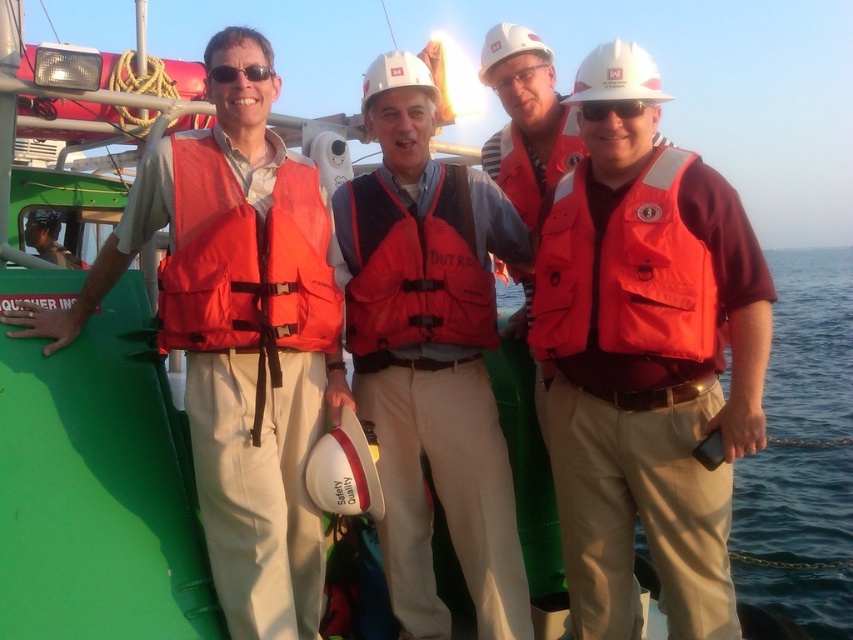
You are a safety inspector on the boat and need to check if the equipment is properly positioned. Are the matte white goggles at center placed in front of or behind the matte black helmet at left?

The matte white goggles at center is behind the matte black helmet at left, so it is placed behind.

You are a safety inspector on the boat and need to ensure all equipment meets size regulations. According to the image, which item, the matte black helmet at left or the matte white goggles at center, is larger in size?

The matte black helmet at left is larger in size compared to the matte white goggles at center.

You are a photographer standing on the deck of a boat and want to take a closeup photo of the orange fabric life vest at center. Considering the camera you have can focus on objects within 10 feet, will you be able to take a clear photo of it?

The orange fabric life vest at center is 10.27 feet away from the camera, which is slightly beyond the 10 feet focusing range. Therefore, the camera may not be able to focus properly, resulting in a blurry image.